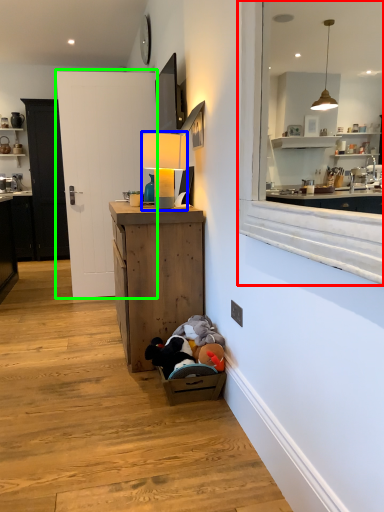
Question: Which is farther away from window (highlighted by a red box)? table lamp (highlighted by a blue box) or door (highlighted by a green box)?

Choices:
 (A) table lamp
 (B) door

Answer: (B)